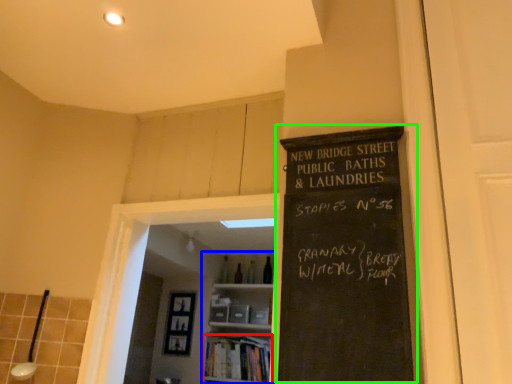
Question: Considering the real-world distances, which object is farthest from book (highlighted by a red box)? bookshelf (highlighted by a blue box) or bulletin board (highlighted by a green box)?

Choices:
 (A) bookshelf
 (B) bulletin board

Answer: (B)